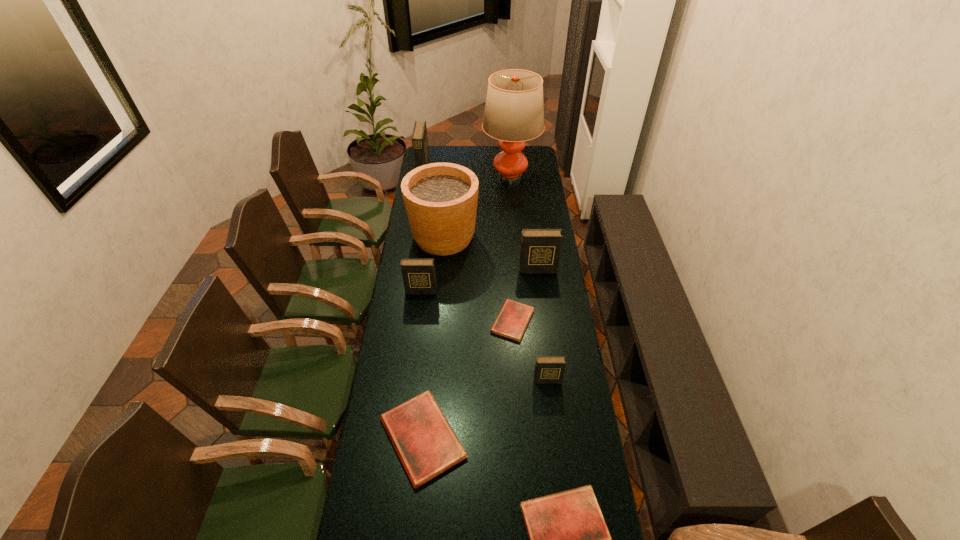
Identify the location of the nearest dark diary. (548, 369).

This screenshot has width=960, height=540. In order to click on the third shortest diary in this screenshot , I will do `click(425, 442)`.

Where is `the biggest red diary`? The height and width of the screenshot is (540, 960). the biggest red diary is located at coordinates (425, 442).

Locate an element on the screen. The image size is (960, 540). the smallest red diary is located at coordinates (511, 322).

Find the location of `the shortest object`. the shortest object is located at coordinates click(x=511, y=322).

In order to click on vacant area situated on the left of the orange lamp in this screenshot , I will do `click(423, 176)`.

At what (x,y) coordinates should I click in order to perform the action: click on free space located on the front of the seventh nearest object. Please return your answer as a coordinate pair (x, y). This screenshot has height=540, width=960. Looking at the image, I should click on (438, 308).

This screenshot has width=960, height=540. Find the location of `blank space located 0.170m on the front cover of the tallest diary`. blank space located 0.170m on the front cover of the tallest diary is located at coordinates (457, 172).

The height and width of the screenshot is (540, 960). What are the coordinates of `free region located 0.260m on the front cover of the sixth nearest diary` in the screenshot? It's located at (543, 319).

Where is `blank area located on the front cover of the fifth shortest object`? This screenshot has width=960, height=540. blank area located on the front cover of the fifth shortest object is located at coordinates (418, 320).